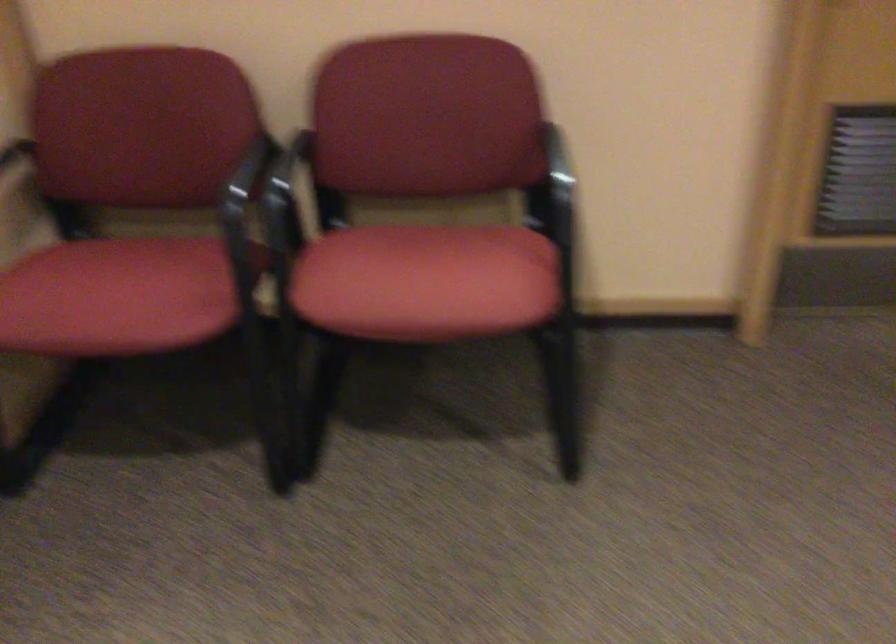
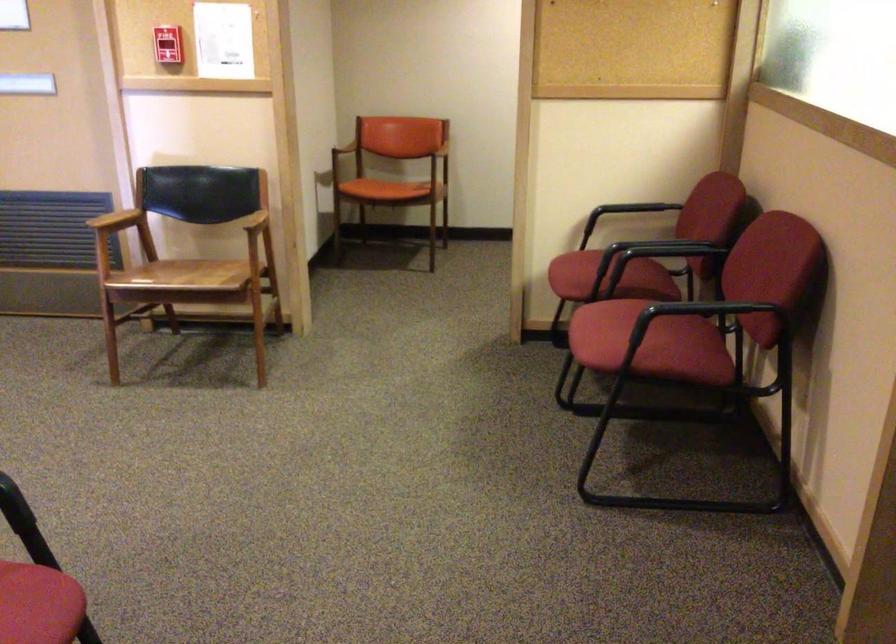
In the second image, find the point that corresponds to [203,268] in the first image.

(608, 278)